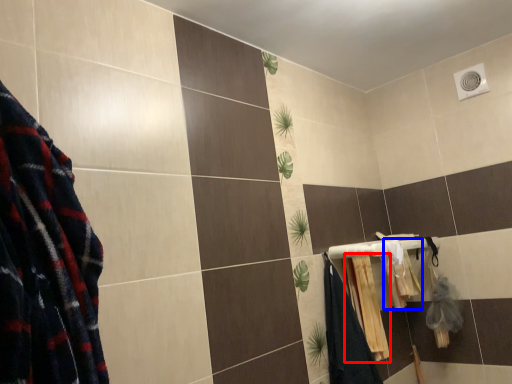
Question: Which point is closer to the camera, bath towel (highlighted by a red box) or bath towel (highlighted by a blue box)?

Choices:
 (A) bath towel
 (B) bath towel

Answer: (A)